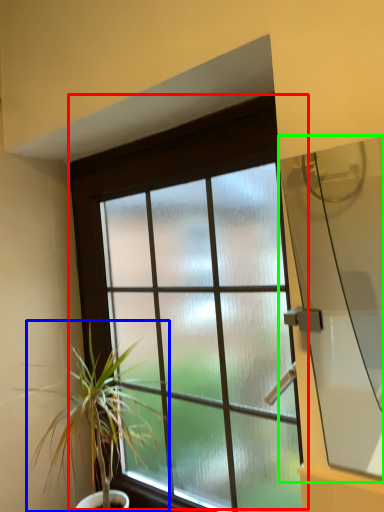
Question: Estimate the real-world distances between objects in this image. Which object is closer to window (highlighted by a red box), houseplant (highlighted by a blue box) or window screen (highlighted by a green box)?

Choices:
 (A) houseplant
 (B) window screen

Answer: (A)